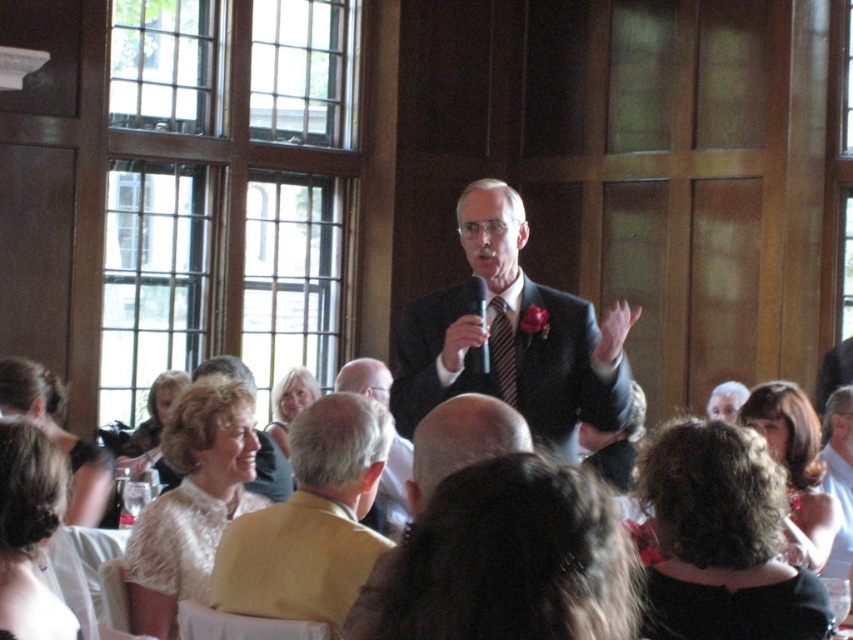
Question: Does light brown hair at lower left appear on the right side of white fur monkey at upper right?

Choices:
 (A) yes
 (B) no

Answer: (B)

Question: Does matte black suit at center appear on the left side of yellow fabric at center?

Choices:
 (A) no
 (B) yes

Answer: (A)

Question: Which point appears farthest from the camera in this image?

Choices:
 (A) (469, 374)
 (B) (682, 604)
 (C) (416, 484)
 (D) (828, 480)

Answer: (D)

Question: Does dark brown hair at center appear over light beige fabric at upper left?

Choices:
 (A) yes
 (B) no

Answer: (A)

Question: Which of the following is the closest to the observer?

Choices:
 (A) white fur monkey at upper right
 (B) light brown leather jacket at upper right

Answer: (B)

Question: Which of the following is the farthest from the observer?

Choices:
 (A) striped silk tie at center
 (B) light beige fabric at upper left

Answer: (A)